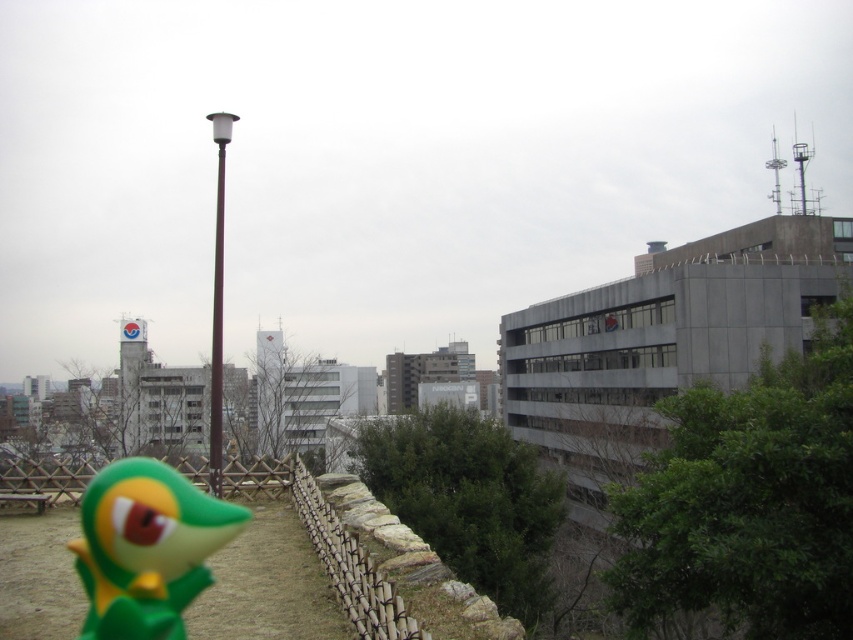
Looking at this image, you are a delivery drone with a maximum flight range of 80 feet. You need to deliver a package from the green matte toy at lower left to the brown polished metal lamp post at center. Can you complete the delivery without needing a recharge?

The distance between the green matte toy at lower left and the brown polished metal lamp post at center is 82.06 feet, which exceeds the drone s maximum flight range of 80 feet. Therefore, the drone cannot complete the delivery without recharging.

You are standing in the park and see two points marked in the image. Which point is closer to you, point (183, 573) or point (212, 385)?

Point (183, 573) is closer to the camera than point (212, 385), so the point closer to you is point (183, 573).

You are standing at the center of the park and see the brown polished metal lamp post at center. If you walk straight ahead, will you reach the lamp post before the wooden fence?

The brown polished metal lamp post at center is located at point (218,307), which is closer to the viewer than the wooden fence in the middle ground. Therefore, you will reach the lamp post before the wooden fence.